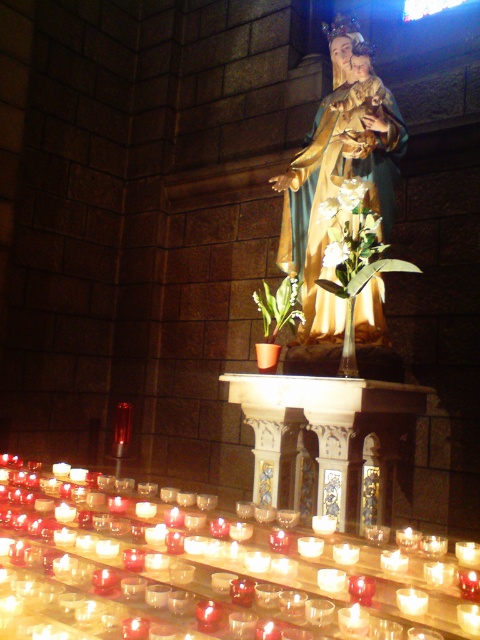
You are a visitor standing at the entrance of the church. You want to light the translucent glass candle at lower left. Considering your height is 1.65 meters, can you reach it without any assistance?

The translucent glass candle at lower left is 1.62 meters from the camera. Since your height is 1.65 meters, you can reach it without needing assistance.

You are standing in the church and want to take a photo of the statue. You notice two points marked on the floor where you can stand to get a good angle. The first point is at coordinates point (x=304, y=336) and the second point is at coordinates point (x=336, y=243). Which point should you choose if you want to be closer to the statue?

You should choose point (x=336, y=243) because it is closer to the statue than point (x=304, y=336), which is behind it.